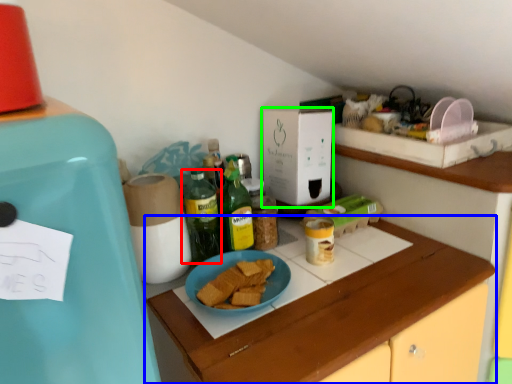
Question: Which is nearer to the bottle (highlighted by a red box)? cabinetry (highlighted by a blue box) or box (highlighted by a green box).

Choices:
 (A) cabinetry
 (B) box

Answer: (B)